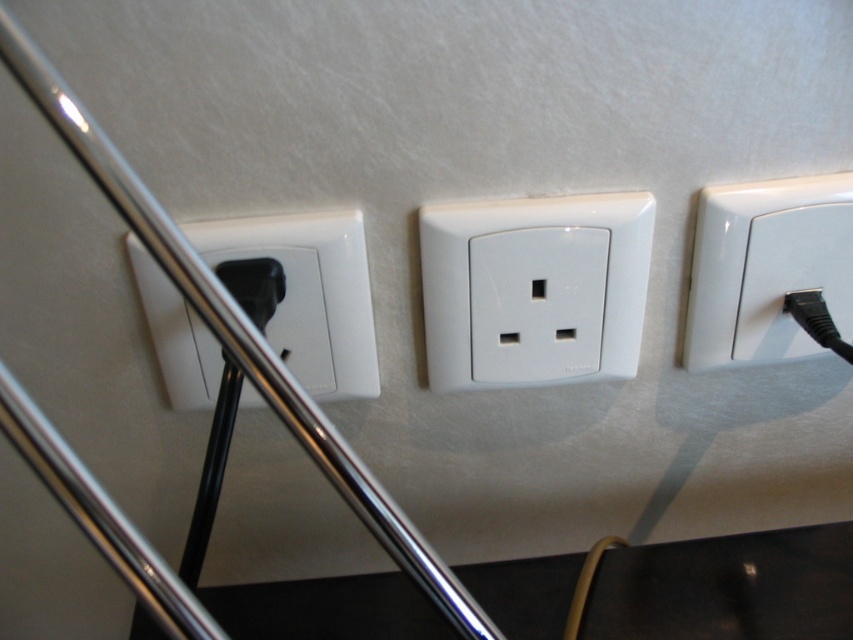
You are holding a power strip and need to plug it into an outlet. You see the white glossy electrical outlet at center and the white glossy electrical outlet at upper right. Which one is located to the left of the other?

The white glossy electrical outlet at center is to the left of the white glossy electrical outlet at upper right.

You are trying to plug in a new device but notice that the white plastic outlet at left and the white glossy electrical outlet at center are both partially blocked. Based on their positions, which outlet can you access more easily?

The white glossy electrical outlet at center can be accessed more easily because the white plastic outlet at left is behind it, making it less obstructed.

You are standing in front of a wall with three electrical outlets. The left outlet has a black plug, the middle is empty, and the right also has a black plug. There is a point marked at coordinates [309,292]. Which outlet does this point correspond to?

The point at coordinates [309,292] corresponds to the white plastic outlet at left.